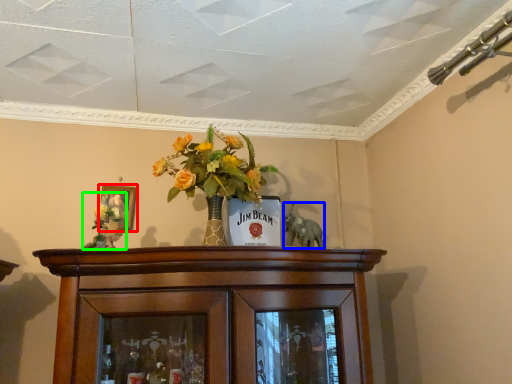
Question: Which object is positioned closest to picture frame (highlighted by a red box)? Select from animal (highlighted by a blue box) and floral arrangement (highlighted by a green box).

Choices:
 (A) animal
 (B) floral arrangement

Answer: (B)